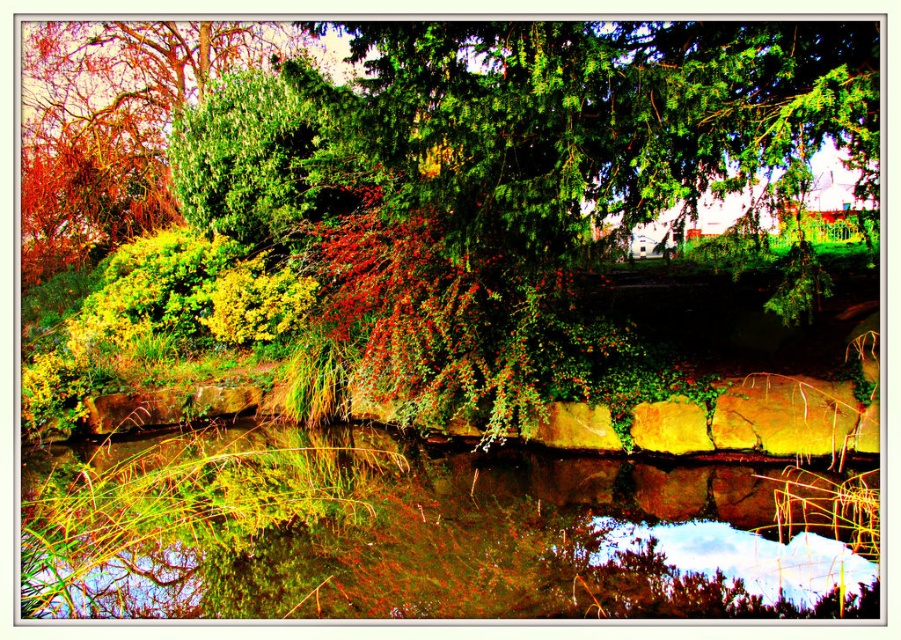
Question: Is green leafy tree at upper center above green mossy water at center?

Choices:
 (A) yes
 (B) no

Answer: (A)

Question: Is the position of green leafy tree at upper center less distant than that of green mossy water at center?

Choices:
 (A) yes
 (B) no

Answer: (A)

Question: Is green leafy tree at upper center positioned before green mossy water at center?

Choices:
 (A) no
 (B) yes

Answer: (B)